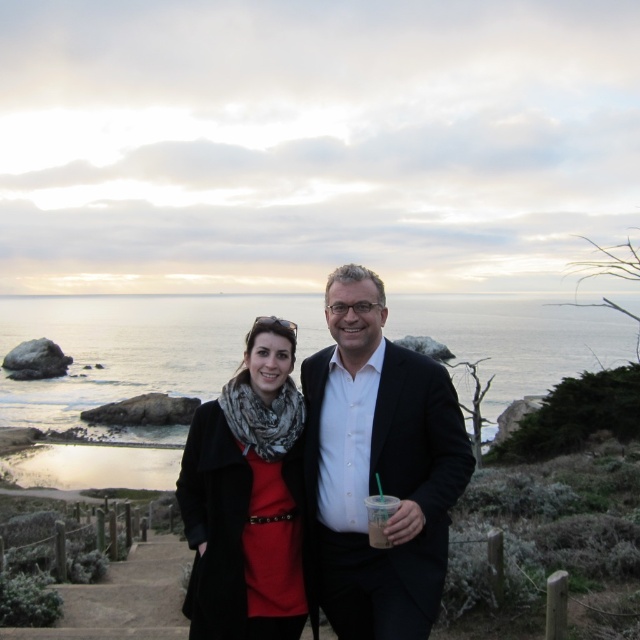
Looking at this image, you are taking a photo of two people wearing black attire. There is a matte black suit at center and a matte black coat at center. Based on their positions, which one is positioned to the right?

The matte black suit at center is to the right of the matte black coat at center.

You are a photographer planning to take a portrait of the two people in the scene. You want to ensure their outfits stand out against the background. Based on the scene description, which object in the image would you adjust the camera focus to blur so that the matte black suit at center and the clear water at center are the main subjects?

The clear water at center is much taller than the matte black suit at center, so adjusting the focus to blur the clear water at center would ensure the matte black suit at center remains in focus as the main subject.

You are standing in the coastal scene and want to move from the point closer to you to the farther point. Which path would you take between the two points, point (157, 432) and point (401, 630)?

The path from point (157, 432) to point (401, 630) would require moving away from the viewer since point (157, 432) is closer to you than point (401, 630).